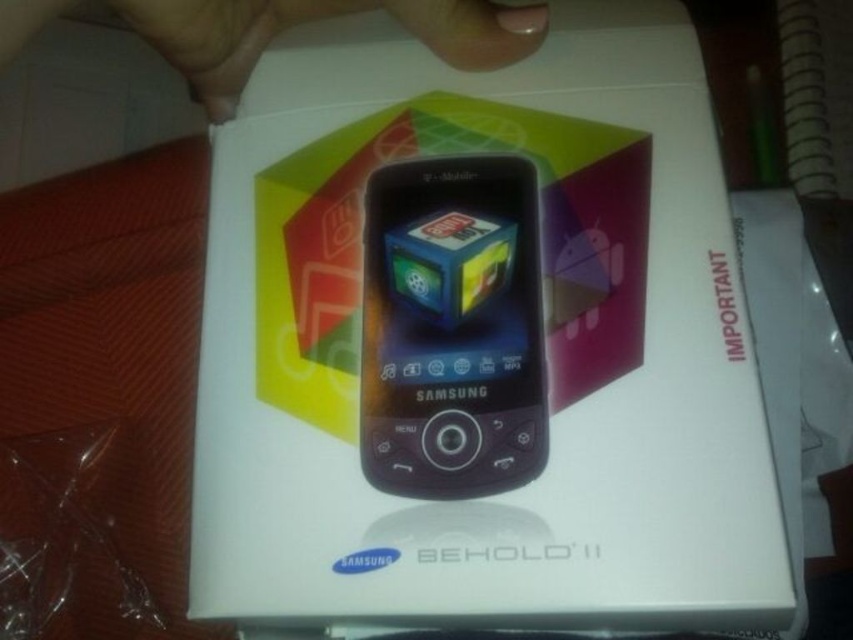
You are a delivery person who needs to place the white matte box at center and the nail polish at upper center into a small storage container. The container can only hold items that are placed one above the other. Can you fit both items into the container based on their current positions?

The white matte box at center is below the nail polish at upper center, so they are already arranged vertically with the nail polish above the box. This means you can fit both items into the container by placing the nail polish at upper center on top and the white matte box at center below it.

Based on the photo, you are examining the Samsung Behold II packaging and notice two points marked on the box. The first point is at coordinates point (728, 356) and the second is at point (421, 160). From your perspective, which point appears closer to you?

Point (728, 356) is closer to the camera than point (421, 160).

You are holding a Samsung Behold II smartphone. You want to place it on a shelf that is 15 inches away from you. Can you place the white matte box at center on the shelf without moving closer?

The distance between the white matte box at center and the viewer is 14.88 inches, which is less than 15 inches. Therefore, you can place the white matte box at center on the shelf without moving closer.